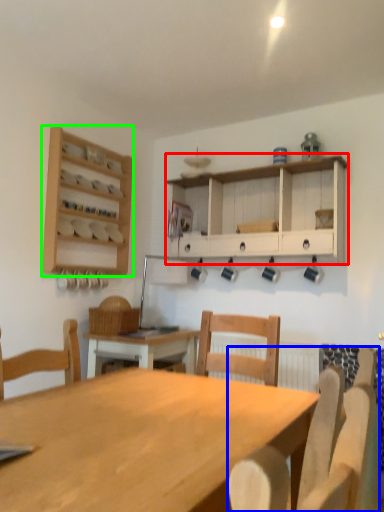
Question: Considering the real-world distances, which object is farthest from cabinetry (highlighted by a red box)? chair (highlighted by a blue box) or shelf (highlighted by a green box)?

Choices:
 (A) chair
 (B) shelf

Answer: (A)